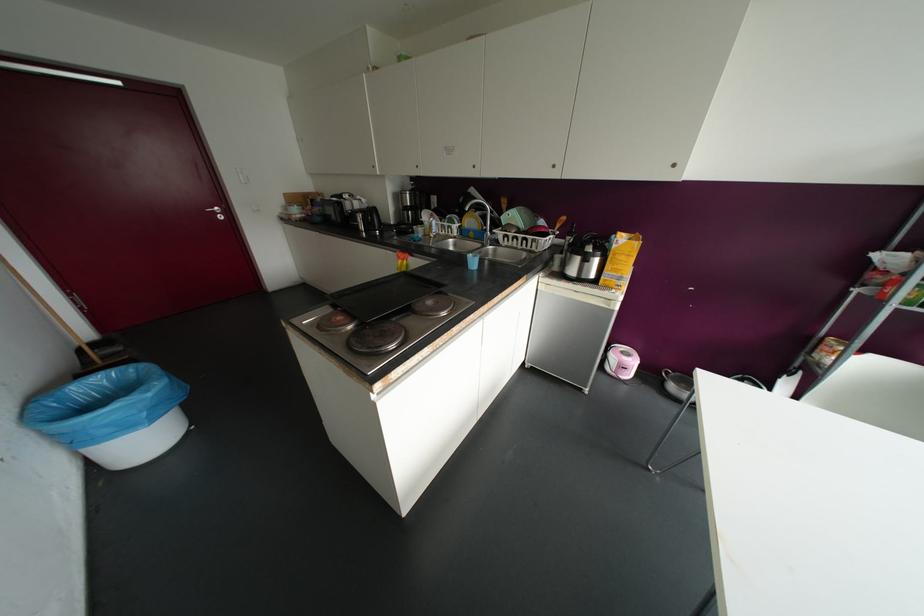
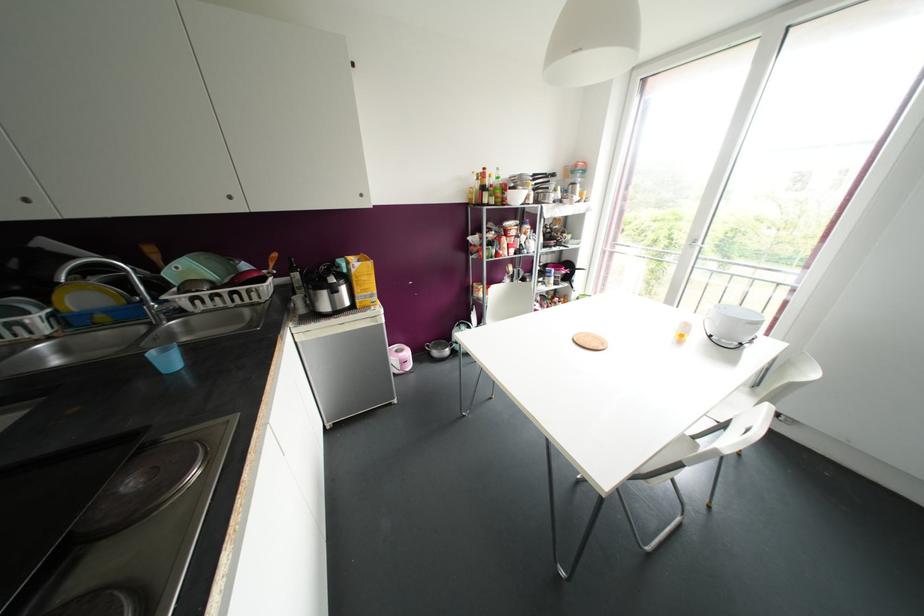
In the second image, find the point that corresponds to point 622,257 in the first image.

(363, 277)